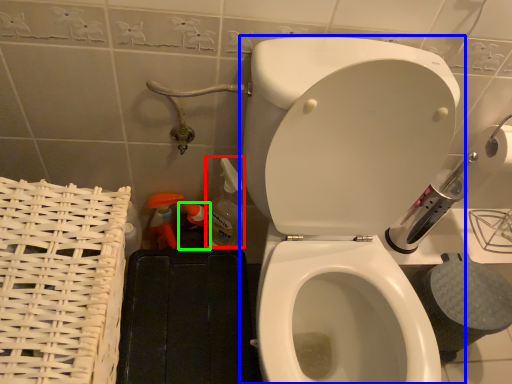
Question: Which object is the closest to the cleaning product (highlighted by a red box)? Choose among these: toilet (highlighted by a blue box) or cleaning product (highlighted by a green box).

Choices:
 (A) toilet
 (B) cleaning product

Answer: (B)